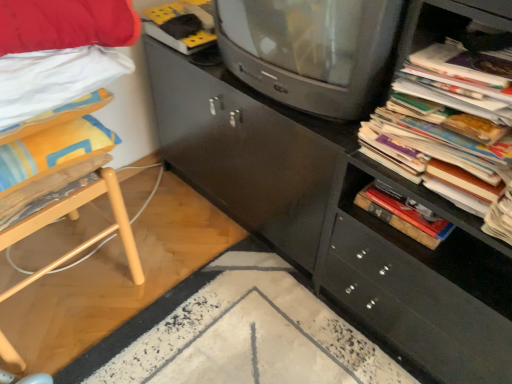
I want to click on vacant space in between light wood chair at left and matte black cabinet at center, so click(210, 287).